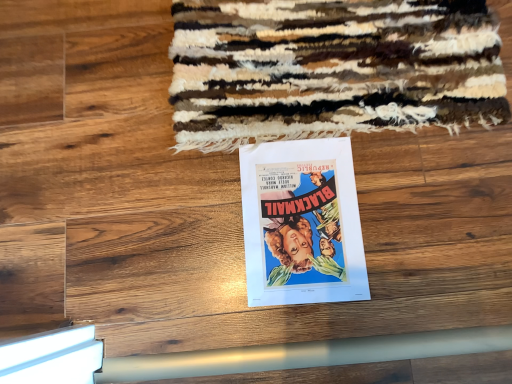
Identify the location of free space to the back side of matte paper poster at center. tap(285, 92).